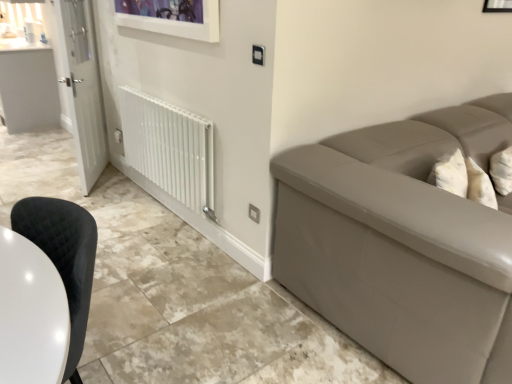
I want to click on vacant area situated to the left side of white glossy door at left, so click(x=48, y=183).